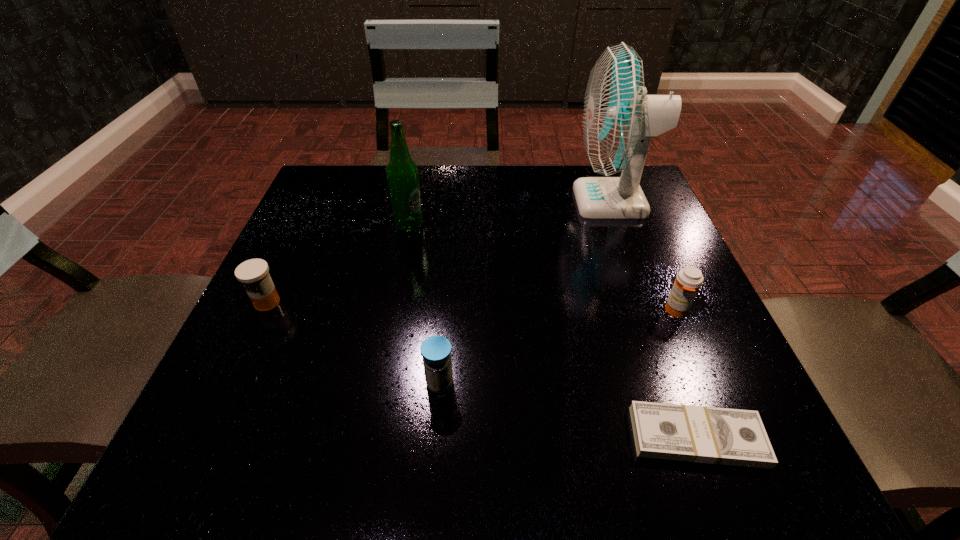
You are a GUI agent. You are given a task and a screenshot of the screen. Output one action in this format:
    pyautogui.click(x=<x>, y=<y>)
    Task: Click on the free location that satisfies the following two spatial constraints: 1. on the label of the fifth object from right to left; 2. on the right side of the second medicine from left to right
    The width and height of the screenshot is (960, 540).
    Given the screenshot: What is the action you would take?
    pyautogui.click(x=379, y=383)

The width and height of the screenshot is (960, 540). I want to click on vacant region that satisfies the following two spatial constraints: 1. on the label of the rightmost medicine; 2. on the left side of the second tallest object, so click(x=394, y=310).

Image resolution: width=960 pixels, height=540 pixels. In order to click on free location that satisfies the following two spatial constraints: 1. on the back side of the rightmost medicine; 2. on the label of the leftmost medicine in this screenshot , I will do pyautogui.click(x=673, y=302).

Find the location of a particular element. This screenshot has height=540, width=960. free point that satisfies the following two spatial constraints: 1. in front of the rightmost medicine to face the airflow; 2. on the left side of the tallest object is located at coordinates (653, 310).